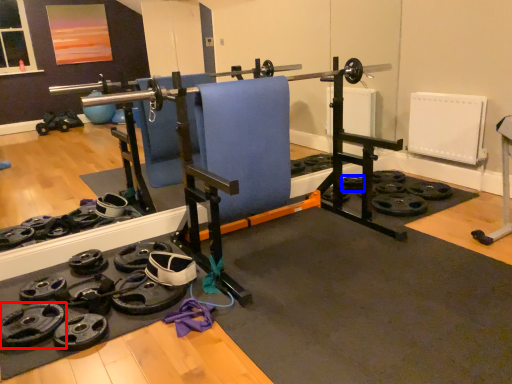
Question: Which point is closer to the camera, wheel (highlighted by a red box) or wheel (highlighted by a blue box)?

Choices:
 (A) wheel
 (B) wheel

Answer: (A)